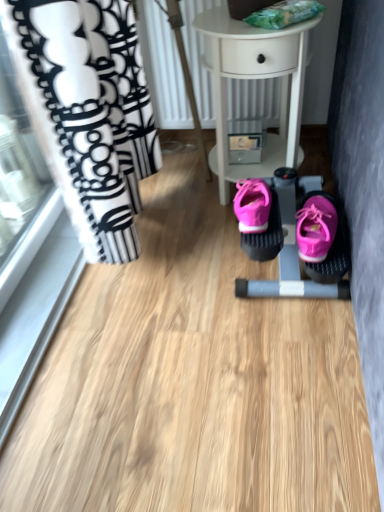
Question: From a real-world perspective, does pink fabric baby carriage at center stand above pink suede shoe at center?

Choices:
 (A) no
 (B) yes

Answer: (A)

Question: Does pink fabric baby carriage at center have a greater width compared to pink suede shoe at center?

Choices:
 (A) yes
 (B) no

Answer: (A)

Question: Is pink fabric baby carriage at center positioned in front of pink suede shoe at center?

Choices:
 (A) no
 (B) yes

Answer: (A)

Question: Is pink fabric baby carriage at center positioned with its back to pink suede shoe at center?

Choices:
 (A) yes
 (B) no

Answer: (B)

Question: Does pink fabric baby carriage at center come behind pink suede shoe at center?

Choices:
 (A) no
 (B) yes

Answer: (B)

Question: Is pink fabric baby carriage at center to the right of pink suede shoe at center from the viewer's perspective?

Choices:
 (A) no
 (B) yes

Answer: (A)

Question: Can you confirm if pink suede shoe at center is bigger than white glossy table at center?

Choices:
 (A) yes
 (B) no

Answer: (B)

Question: Considering the relative positions of pink suede shoe at center and white glossy table at center in the image provided, is pink suede shoe at center to the right of white glossy table at center from the viewer's perspective?

Choices:
 (A) yes
 (B) no

Answer: (A)

Question: Is pink suede shoe at center wider than white glossy table at center?

Choices:
 (A) no
 (B) yes

Answer: (A)

Question: From the image's perspective, does pink suede shoe at center appear lower than white glossy table at center?

Choices:
 (A) no
 (B) yes

Answer: (B)

Question: Is pink suede shoe at center touching white glossy table at center?

Choices:
 (A) no
 (B) yes

Answer: (A)

Question: From a real-world perspective, is pink suede shoe at center under white glossy table at center?

Choices:
 (A) yes
 (B) no

Answer: (A)

Question: From the image's perspective, is white glossy table at center located beneath pink suede shoe at center?

Choices:
 (A) no
 (B) yes

Answer: (A)